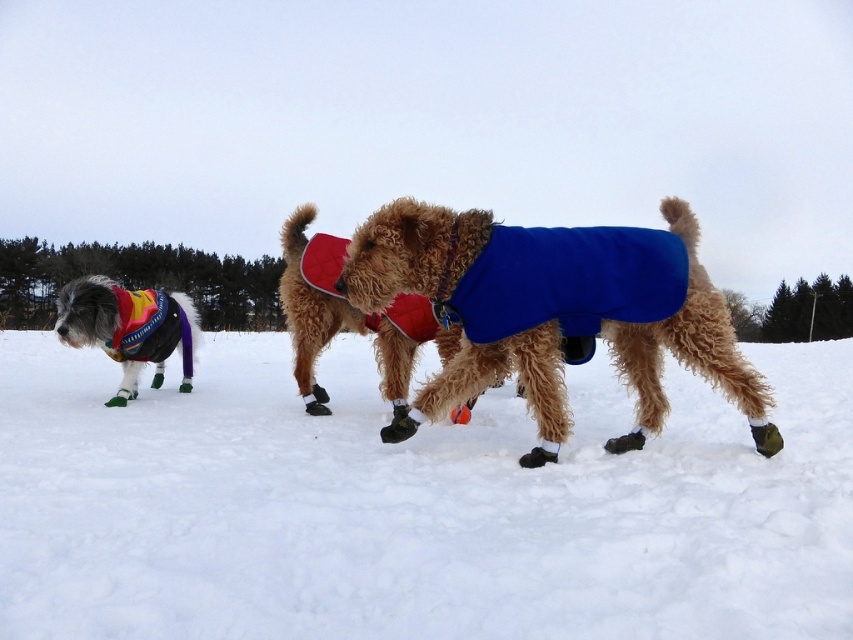
You are a dog owner trying to find your pet in the snowy scene. Your dog is wearing a blue fleece coat at center. Where would you look relative to the white fluffy snow at center?

The blue fleece coat at center is behind the white fluffy snow at center, so you should look behind the white fluffy snow at center to find your dog.

You are standing in a snowy park and want to walk to the point marked at coordinates point (268, 497). If you can walk 1.5 meters per second, how long will it take you to reach that point?

The distance to point (268, 497) is 3.80 meters. At a walking speed of 1.5 meters per second, it will take approximately 2.53 seconds to reach the point.

Based on the photo, you are a dog owner who wants to walk your dog through the snowy area. Which surface, the white fluffy snow at center or the multicolored knitted sweater at left, is lower to the ground and thus safer for your dog to walk on?

The white fluffy snow at center is shorter than the multicolored knitted sweater at left, so it is lower to the ground and safer for your dog to walk on.